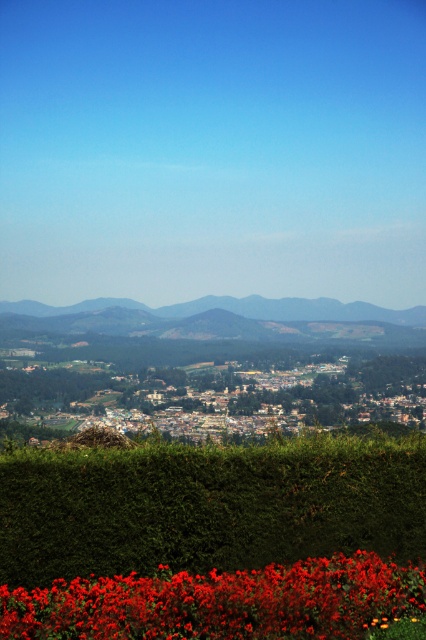
Question: Which object is farther from the camera taking this photo?

Choices:
 (A) green leafy hedge at lower center
 (B) gray textured mountain at center

Answer: (B)

Question: Is vibrant matte red flowers at bottom to the right of gray textured mountain at center from the viewer's perspective?

Choices:
 (A) no
 (B) yes

Answer: (B)

Question: Which of these objects is positioned farthest from the gray textured mountain at center?

Choices:
 (A) vibrant matte red flowers at bottom
 (B) green leafy hedge at lower center

Answer: (A)

Question: Can you confirm if vibrant matte red flowers at bottom is smaller than gray textured mountain at center?

Choices:
 (A) yes
 (B) no

Answer: (A)

Question: Is vibrant matte red flowers at bottom wider than gray textured mountain at center?

Choices:
 (A) no
 (B) yes

Answer: (A)

Question: Which point is farther to the camera?

Choices:
 (A) gray textured mountain at center
 (B) green leafy hedge at lower center

Answer: (A)